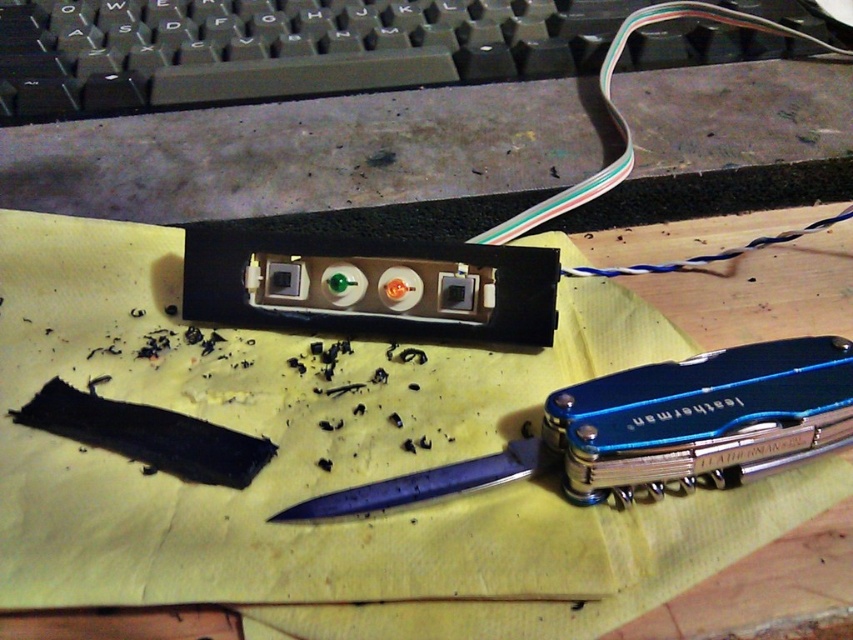
Who is positioned more to the right, black plastic keyboard at upper center or blue metallic pocketknife at lower center?

blue metallic pocketknife at lower center is more to the right.

Is the position of black plastic keyboard at upper center more distant than that of blue metallic pocketknife at lower center?

Yes, black plastic keyboard at upper center is behind blue metallic pocketknife at lower center.

The width and height of the screenshot is (853, 640). What are the coordinates of `black plastic keyboard at upper center` in the screenshot? It's located at (280, 49).

Can you confirm if yellow paper at center is positioned below matte plastic plug at center?

Yes, yellow paper at center is below matte plastic plug at center.

Is point (111, 260) closer to viewer compared to point (404, 305)?

No, it is not.

Image resolution: width=853 pixels, height=640 pixels. In order to click on yellow paper at center in this screenshot , I will do click(x=332, y=464).

Can you confirm if yellow paper at center is shorter than black plastic keyboard at upper center?

In fact, yellow paper at center may be taller than black plastic keyboard at upper center.

Which is in front, point (315, 426) or point (277, 54)?

Point (315, 426)

Locate an element on the screen. This screenshot has height=640, width=853. yellow paper at center is located at coordinates (332, 464).